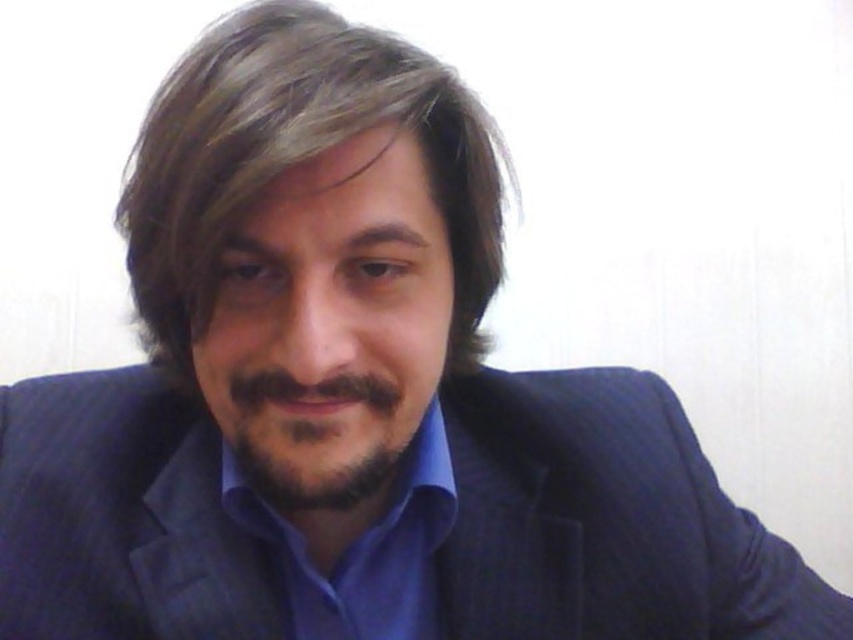
You are a photographer adjusting the lighting for a portrait. You notice the blue smooth shirt at center and the dark brown stubble at center in the frame. Which of these two items is closer to the bottom edge of the image?

The blue smooth shirt at center is positioned under the dark brown stubble at center, meaning it is closer to the bottom edge of the image.

You are a photographer setting up for a portrait session. You notice the dark blue textured suit at center and the dark brown stubble at center in the image. Which object is closer to the camera?

The dark brown stubble at center is closer to the camera than the dark blue textured suit at center because the dark blue textured suit at center is positioned under the dark brown stubble at center.

You are a photographer arranging a professional headshot session. You need to ensure that the subject has enough space between their hair and shirt to avoid any visual clutter. Based on the image provided, is the distance between the brownsmoothhair at center and the blue smooth shirt at center sufficient to achieve this?

The brownsmoothhair at center is above the blue smooth shirt at center, so there is enough space between them to avoid visual clutter in the professional headshot.